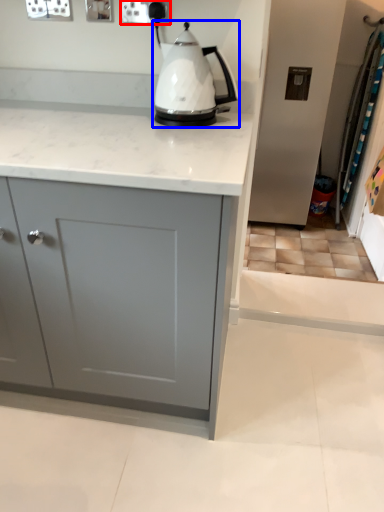
Question: Which object appears closest to the camera in this image, electric outlet (highlighted by a red box) or kettle (highlighted by a blue box)?

Choices:
 (A) electric outlet
 (B) kettle

Answer: (B)